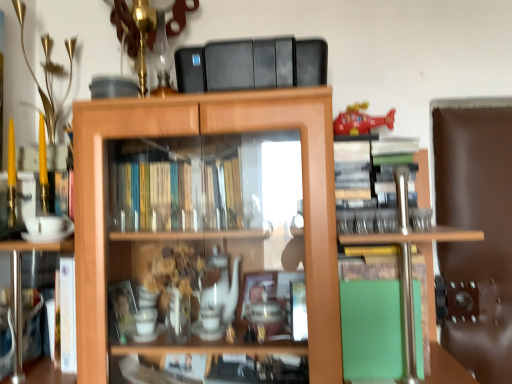
Question: Considering the positions of green matte book at lower left, marked as the 2th book in a right-to-left arrangement, and wooden cabinet at center in the image, is green matte book at lower left, marked as the 2th book in a right-to-left arrangement, bigger or smaller than wooden cabinet at center?

Choices:
 (A) big
 (B) small

Answer: (B)

Question: From the image's perspective, is green matte book at lower left, placed as the first book when sorted from left to right, located above or below wooden cabinet at center?

Choices:
 (A) above
 (B) below

Answer: (B)

Question: Which object is positioned closest to the shiny plastic helicopter at upper right?

Choices:
 (A) wooden cabinet at center
 (B) green matte book at lower right, acting as the 2th book starting from the left
 (C) green matte book at lower left, placed as the first book when sorted from left to right

Answer: (A)

Question: Which is nearer to the green matte book at lower right, acting as the 2th book starting from the left?

Choices:
 (A) wooden cabinet at center
 (B) shiny plastic helicopter at upper right
 (C) green matte book at lower left, placed as the first book when sorted from left to right

Answer: (A)